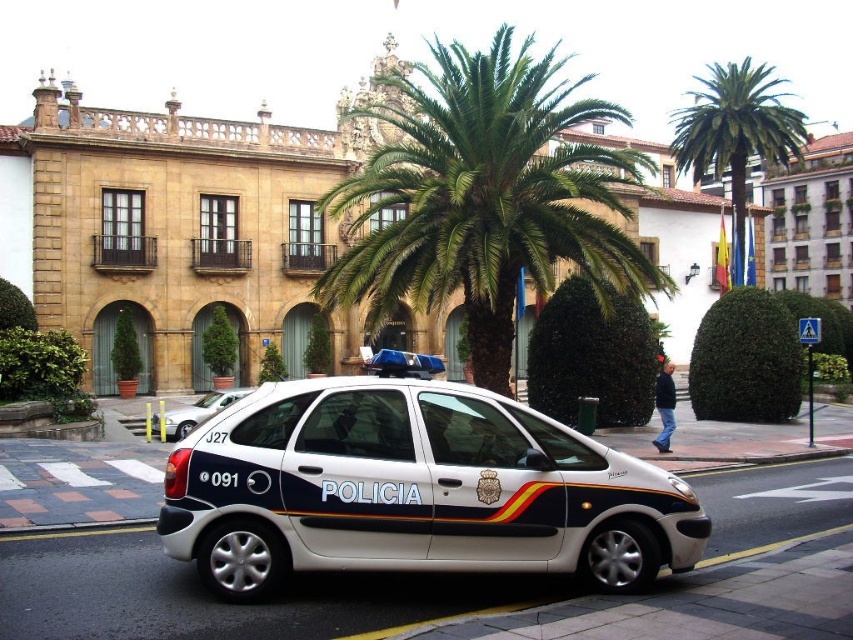
Question: Which point is farther from the camera taking this photo?

Choices:
 (A) (726, 115)
 (B) (254, 540)
 (C) (323, 202)
 (D) (662, 404)

Answer: (A)

Question: Can you confirm if white metallic police car at center is positioned to the right of matte white car at center?

Choices:
 (A) yes
 (B) no

Answer: (B)

Question: Can you confirm if white metallic police car at center is positioned above green leafy palm tree at center?

Choices:
 (A) yes
 (B) no

Answer: (B)

Question: Does white metallic police car at center have a greater width compared to green leafy palm tree at center?

Choices:
 (A) yes
 (B) no

Answer: (B)

Question: Estimate the real-world distances between objects in this image. Which object is farther from the white metallic police car at center?

Choices:
 (A) matte white car at center
 (B) white glossy police van at center
 (C) green leafy palm tree at upper center

Answer: (C)

Question: Which of the following is the closest to the observer?

Choices:
 (A) white metallic police car at center
 (B) green leafy palm tree at center
 (C) white glossy police van at center
 (D) matte white car at center

Answer: (A)